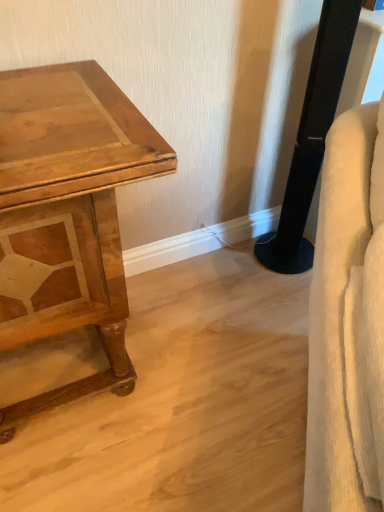
Question: Is black plastic speaker at right bigger or smaller than white fabric swivel chair at right?

Choices:
 (A) big
 (B) small

Answer: (A)

Question: Is black plastic speaker at right in front of or behind white fabric swivel chair at right in the image?

Choices:
 (A) front
 (B) behind

Answer: (B)

Question: Based on their relative distances, which object is farther from the white fabric swivel chair at right?

Choices:
 (A) wooden table at left
 (B) black plastic speaker at right

Answer: (B)

Question: Based on their relative distances, which object is nearer to the white fabric swivel chair at right?

Choices:
 (A) black plastic speaker at right
 (B) wooden table at left

Answer: (B)